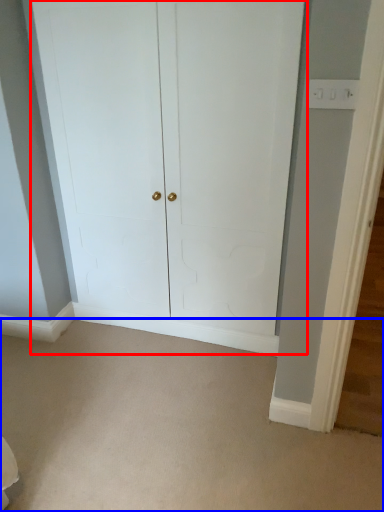
Question: Which object appears farthest to the camera in this image, door (highlighted by a red box) or plain (highlighted by a blue box)?

Choices:
 (A) door
 (B) plain

Answer: (A)